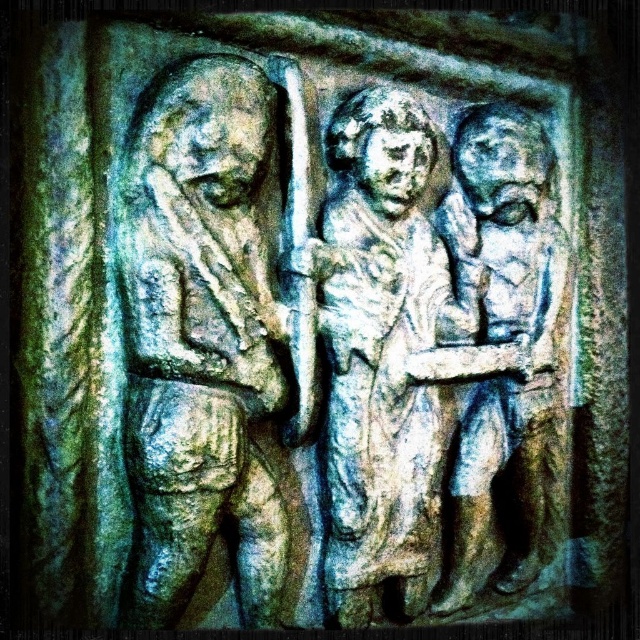
Question: Where is carved stone figure at left located in relation to carved stone figure at right in the image?

Choices:
 (A) right
 (B) left

Answer: (B)

Question: Which object is the farthest from the carved stone figures at center?

Choices:
 (A) carved stone figure at left
 (B) carved stone figure at right

Answer: (A)

Question: Among these objects, which one is farthest from the camera?

Choices:
 (A) carved stone figure at right
 (B) carved stone figures at center
 (C) carved stone figure at left

Answer: (A)

Question: Is carved stone figures at center in front of carved stone figure at right?

Choices:
 (A) yes
 (B) no

Answer: (A)

Question: Among these objects, which one is farthest from the camera?

Choices:
 (A) carved stone figure at right
 (B) carved stone figures at center

Answer: (A)

Question: Considering the relative positions of carved stone figures at center and carved stone figure at right in the image provided, where is carved stone figures at center located with respect to carved stone figure at right?

Choices:
 (A) above
 (B) below

Answer: (B)